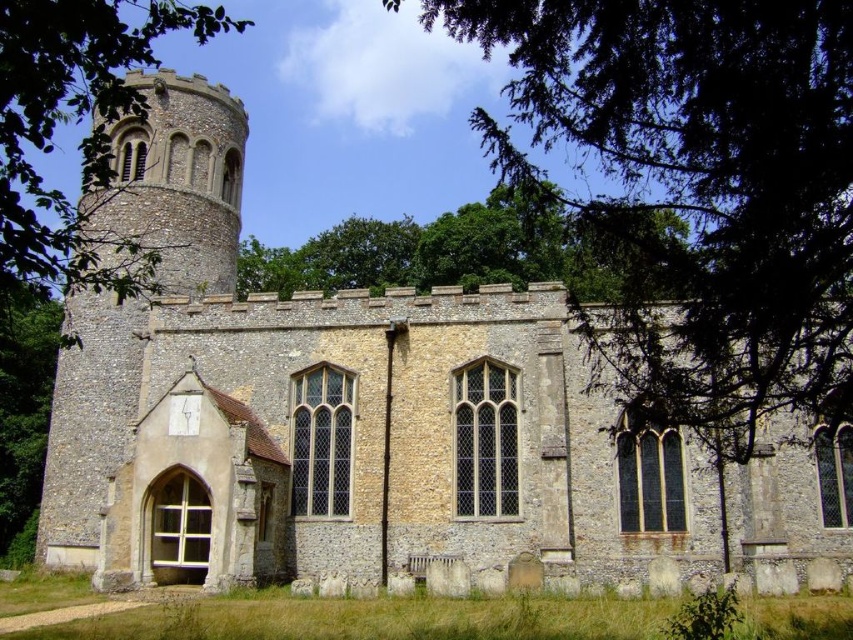
Between point (782, 124) and point (132, 90), which one is positioned in front?

Point (782, 124) is in front.

Locate an element on the screen. The height and width of the screenshot is (640, 853). green leafy tree at upper center is located at coordinates (695, 193).

Who is taller, green leafy tree at upper center or stone tower at center?

Standing taller between the two is green leafy tree at upper center.

Is point (811, 120) farther from camera compared to point (161, 284)?

That is False.

Which is in front, point (576, 134) or point (155, 131)?

Point (576, 134) is more forward.

At what (x,y) coordinates should I click in order to perform the action: click on green leafy tree at upper center. Please return your answer as a coordinate pair (x, y). The image size is (853, 640). Looking at the image, I should click on (695, 193).

Based on the photo, who is higher up, stone tower at center or green leafy tree at upper left?

Positioned higher is green leafy tree at upper left.

The image size is (853, 640). In order to click on stone tower at center in this screenshot , I will do `click(181, 180)`.